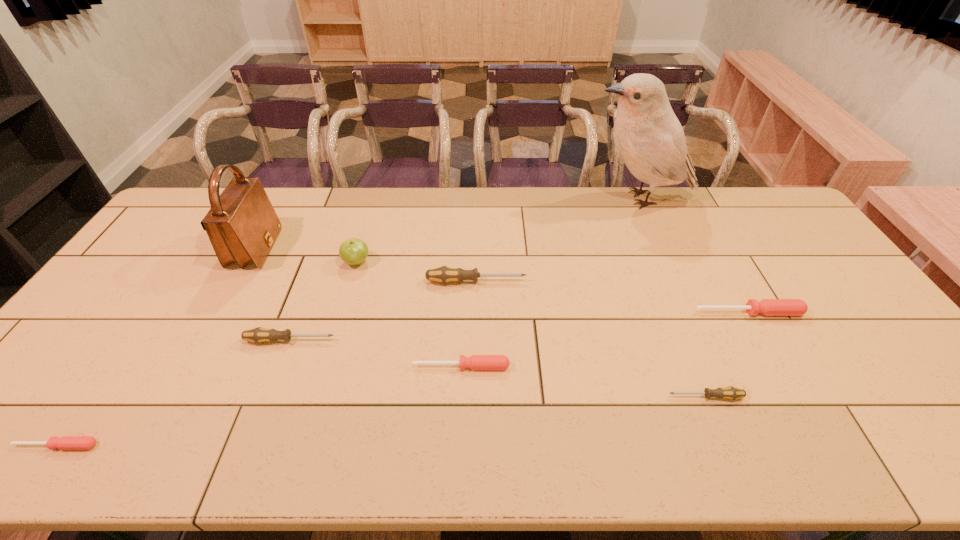
Where is `free space between the white parakeet and the shoulder bag`? This screenshot has width=960, height=540. free space between the white parakeet and the shoulder bag is located at coordinates (447, 224).

In order to click on object that is the fourth closest one to the leftmost red screwdriver in this screenshot , I will do `click(476, 362)`.

Locate an element on the screen. The height and width of the screenshot is (540, 960). object that stands as the closest to the eighth shortest object is located at coordinates (354, 251).

Select which screwdriver appears as the second closest to the white parakeet. Please provide its 2D coordinates. Your answer should be formatted as a tuple, i.e. [(x, y)], where the tuple contains the x and y coordinates of a point satisfying the conditions above.

[(768, 307)]

Identify which screwdriver is the second closest to the farthest red screwdriver. Please provide its 2D coordinates. Your answer should be formatted as a tuple, i.e. [(x, y)], where the tuple contains the x and y coordinates of a point satisfying the conditions above.

[(443, 274)]

Identify the location of the closest gray screwdriver to the rightmost red screwdriver. (732, 393).

Find the location of a particular element. This screenshot has width=960, height=540. gray screwdriver that is the second closest to the second screwdriver from left to right is located at coordinates (732, 393).

Point out which red screwdriver is positioned as the second nearest to the sixth farthest object. Please provide its 2D coordinates. Your answer should be formatted as a tuple, i.e. [(x, y)], where the tuple contains the x and y coordinates of a point satisfying the conditions above.

[(66, 442)]

At what (x,y) coordinates should I click in order to perform the action: click on red screwdriver identified as the second closest to the leftmost object. Please return your answer as a coordinate pair (x, y). This screenshot has width=960, height=540. Looking at the image, I should click on (768, 307).

At what (x,y) coordinates should I click in order to perform the action: click on free spot that satisfies the following two spatial constraints: 1. on the front flap of the shoulder bag; 2. on the back side of the fourth farthest screwdriver. Please return your answer as a coordinate pair (x, y). The image size is (960, 540). Looking at the image, I should click on (192, 366).